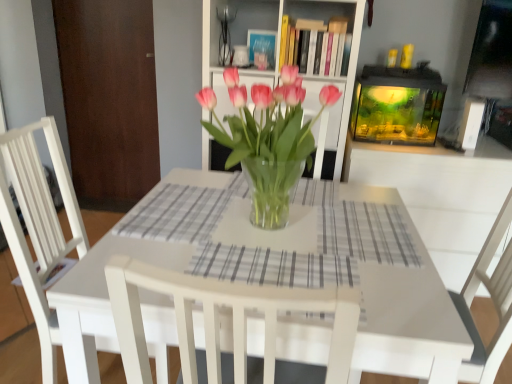
Question: From a real-world perspective, does transparent glass vase at center stand above gray checkered placemat at center, the 2th plaid in the back-to-front sequence?

Choices:
 (A) yes
 (B) no

Answer: (A)

Question: Is transparent glass vase at center positioned with its back to gray checkered placemat at center, acting as the 2th plaid starting from the top?

Choices:
 (A) yes
 (B) no

Answer: (B)

Question: Is transparent glass vase at center in front of gray checkered placemat at center, positioned as the 2th plaid in left-to-right order?

Choices:
 (A) yes
 (B) no

Answer: (B)

Question: Is transparent glass vase at center to the left of gray checkered placemat at center, acting as the 1th plaid starting from the front, from the viewer's perspective?

Choices:
 (A) no
 (B) yes

Answer: (A)

Question: From the image's perspective, is transparent glass vase at center below gray checkered placemat at center, acting as the 1th plaid starting from the front?

Choices:
 (A) no
 (B) yes

Answer: (A)

Question: Considering the relative positions of transparent glass vase at center and gray checkered placemat at center, the 2th plaid in the back-to-front sequence, in the image provided, is transparent glass vase at center behind gray checkered placemat at center, the 2th plaid in the back-to-front sequence,?

Choices:
 (A) yes
 (B) no

Answer: (A)

Question: Does brown wood door at left appear on the right side of gray checkered placemat at center, which is the 1th plaid in bottom-to-top order?

Choices:
 (A) yes
 (B) no

Answer: (B)

Question: Does brown wood door at left have a lesser width compared to gray checkered placemat at center, which is the 1th plaid in bottom-to-top order?

Choices:
 (A) yes
 (B) no

Answer: (A)

Question: Is brown wood door at left directly adjacent to gray checkered placemat at center, acting as the 1th plaid starting from the front?

Choices:
 (A) yes
 (B) no

Answer: (B)

Question: Would you say gray checkered placemat at center, marked as the first plaid in a right-to-left arrangement, is part of brown wood door at left's contents?

Choices:
 (A) no
 (B) yes

Answer: (A)

Question: Is brown wood door at left positioned with its back to gray checkered placemat at center, acting as the 1th plaid starting from the front?

Choices:
 (A) yes
 (B) no

Answer: (B)

Question: From the image's perspective, is brown wood door at left located beneath gray checkered placemat at center, acting as the 1th plaid starting from the front?

Choices:
 (A) no
 (B) yes

Answer: (A)

Question: Does white wood chair at center turn towards gray checkered placemat at center, acting as the 2th plaid starting from the top?

Choices:
 (A) yes
 (B) no

Answer: (B)